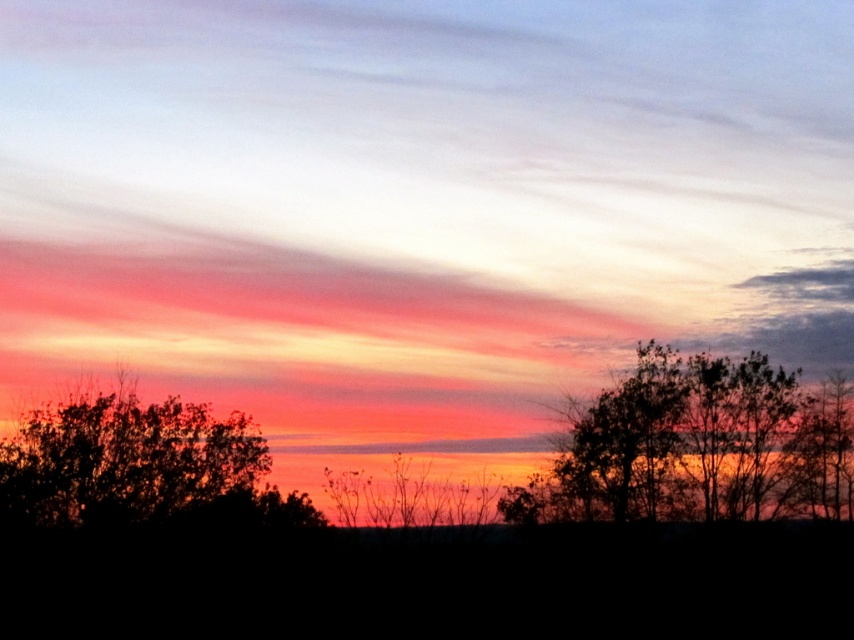
You are an astronomer observing the sunset and notice the silhouette leafy tree at right. Based on its position, can you determine if the tree is located to the east or west of your current position?

The silhouette leafy tree at right is located at point coordinates of [699,445]. Since the sun is setting in the west, the tree is likely positioned to the west of your current location.

You are an astronomer observing the sunset scene. You notice a point at coordinates (699, 445). What object is located at that point?

The point at coordinates (699, 445) is where the silhouette leafy tree at right is located.